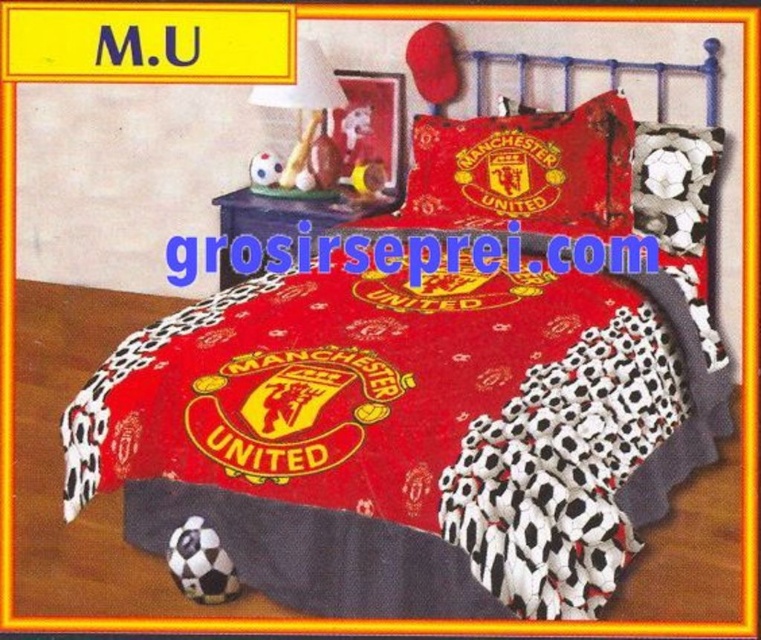
Is red fabric manchester united logo pillow at center further to the viewer compared to soccer-patterned fabric pillow at upper center?

No.

Describe the element at coordinates (524, 170) in the screenshot. I see `red fabric manchester united logo pillow at center` at that location.

Find the location of a particular element. This screenshot has width=761, height=640. red fabric manchester united logo pillow at center is located at coordinates [x=524, y=170].

The height and width of the screenshot is (640, 761). In order to click on matte white lamp at upper center in this screenshot , I will do `click(301, 100)`.

This screenshot has height=640, width=761. What do you see at coordinates (301, 100) in the screenshot?
I see `matte white lamp at upper center` at bounding box center [301, 100].

This screenshot has width=761, height=640. I want to click on matte white lamp at upper center, so click(x=301, y=100).

Who is more distant from viewer, [500,131] or [260,180]?

Point [260,180]

Who is more forward, (570,214) or (272,177)?

Positioned in front is point (570,214).

You are a GUI agent. You are given a task and a screenshot of the screen. Output one action in this format:
    pyautogui.click(x=<x>, y=<y>)
    Task: Click on the red fabric manchester united logo pillow at center
    
    Given the screenshot: What is the action you would take?
    pyautogui.click(x=524, y=170)